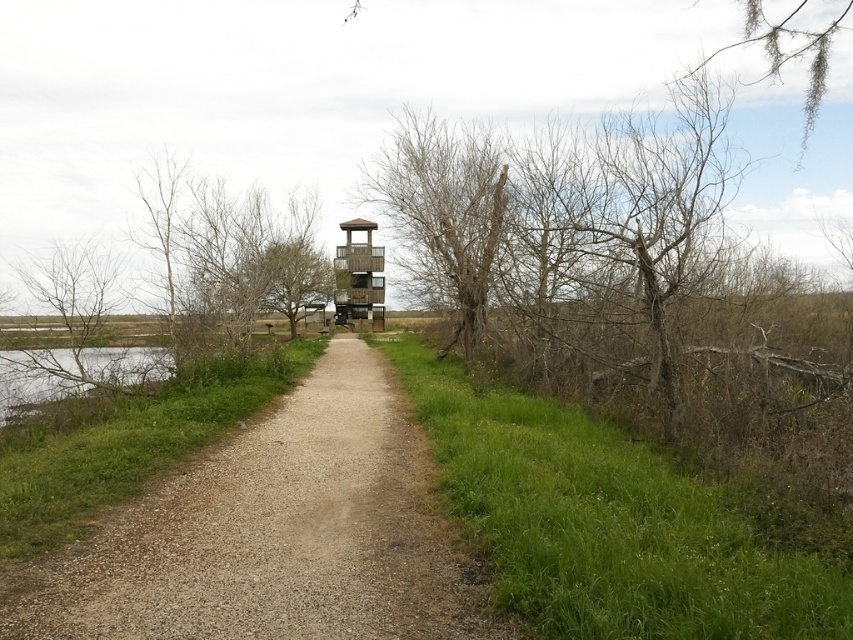
Who is more distant from viewer, (70, 388) or (352, 257)?

Positioned behind is point (352, 257).

Between point (103, 257) and point (363, 317), which one is positioned in front?

Point (103, 257) is more forward.

You are a GUI agent. You are given a task and a screenshot of the screen. Output one action in this format:
    pyautogui.click(x=<x>, y=<y>)
    Task: Click on the bare wood tree at left
    
    Given the screenshot: What is the action you would take?
    pyautogui.click(x=70, y=328)

Does dirt/gravel path at center appear on the left side of bare wood tree at left?

Incorrect, dirt/gravel path at center is not on the left side of bare wood tree at left.

How far apart are dirt/gravel path at center and bare wood tree at left?

They are 4.47 meters apart.

This screenshot has width=853, height=640. I want to click on dirt/gravel path at center, so click(x=273, y=536).

Is bare wood tree at left positioned at the back of green grassy water at lower left?

Yes, bare wood tree at left is behind green grassy water at lower left.

Image resolution: width=853 pixels, height=640 pixels. What are the coordinates of `bare wood tree at left` in the screenshot? It's located at (70, 328).

What do you see at coordinates (70, 328) in the screenshot?
I see `bare wood tree at left` at bounding box center [70, 328].

You are a GUI agent. You are given a task and a screenshot of the screen. Output one action in this format:
    pyautogui.click(x=<x>, y=<y>)
    Task: Click on the bare wood tree at left
    This screenshot has height=640, width=853.
    Given the screenshot: What is the action you would take?
    pyautogui.click(x=70, y=328)